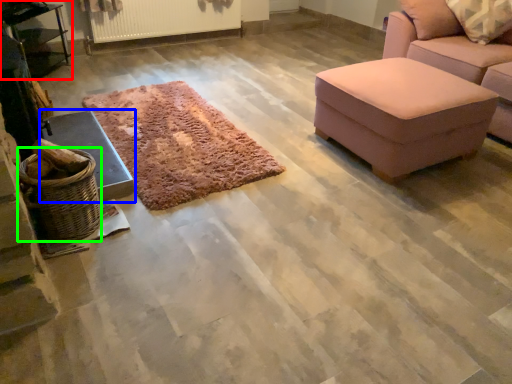
Question: Which object is the farthest from table (highlighted by a red box)? Choose among these: furniture (highlighted by a blue box) or basket (highlighted by a green box).

Choices:
 (A) furniture
 (B) basket

Answer: (B)